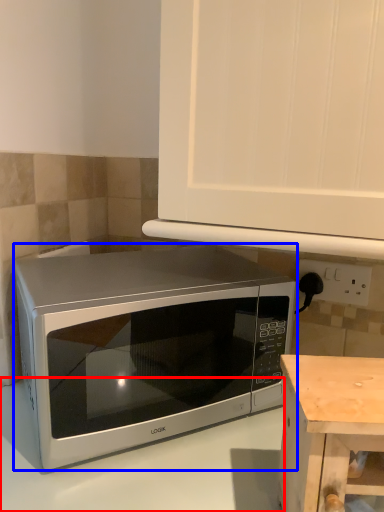
Question: Which object appears closest to the camera in this image, counter top (highlighted by a red box) or microwave oven (highlighted by a blue box)?

Choices:
 (A) counter top
 (B) microwave oven

Answer: (A)